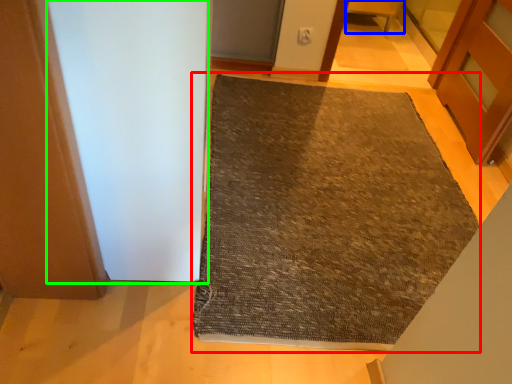
Question: Based on their relative distances, which object is nearer to mat (highlighted by a red box)? Choose from furniture (highlighted by a blue box) and screen door (highlighted by a green box).

Choices:
 (A) furniture
 (B) screen door

Answer: (B)